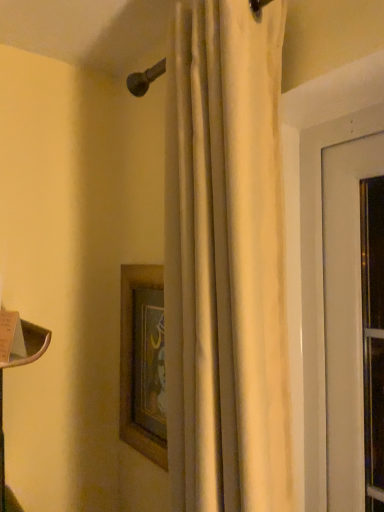
Question: Considering the relative sizes of wooden framed picture at center and white matte curtain at center in the image provided, is wooden framed picture at center shorter than white matte curtain at center?

Choices:
 (A) no
 (B) yes

Answer: (B)

Question: Can you confirm if wooden framed picture at center is bigger than white matte curtain at center?

Choices:
 (A) no
 (B) yes

Answer: (A)

Question: Does wooden framed picture at center turn towards white matte curtain at center?

Choices:
 (A) yes
 (B) no

Answer: (B)

Question: Is white matte curtain at center a part of wooden framed picture at center?

Choices:
 (A) yes
 (B) no

Answer: (B)

Question: Is wooden framed picture at center wider than white matte curtain at center?

Choices:
 (A) yes
 (B) no

Answer: (B)

Question: Can you confirm if wooden framed picture at center is positioned to the right of white matte curtain at center?

Choices:
 (A) no
 (B) yes

Answer: (A)

Question: Is white matte curtain at center wider than wooden framed picture at center?

Choices:
 (A) no
 (B) yes

Answer: (B)

Question: From the image's perspective, does white matte curtain at center appear higher than wooden framed picture at center?

Choices:
 (A) yes
 (B) no

Answer: (A)

Question: Is white matte curtain at center turned away from wooden framed picture at center?

Choices:
 (A) no
 (B) yes

Answer: (A)

Question: Is wooden framed picture at center surrounded by white matte curtain at center?

Choices:
 (A) yes
 (B) no

Answer: (B)

Question: From a real-world perspective, is white matte curtain at center on top of wooden framed picture at center?

Choices:
 (A) no
 (B) yes

Answer: (B)

Question: Is white matte curtain at center next to wooden framed picture at center and touching it?

Choices:
 (A) no
 (B) yes

Answer: (A)

Question: Is wooden framed picture at center bigger or smaller than white matte curtain at center?

Choices:
 (A) small
 (B) big

Answer: (A)